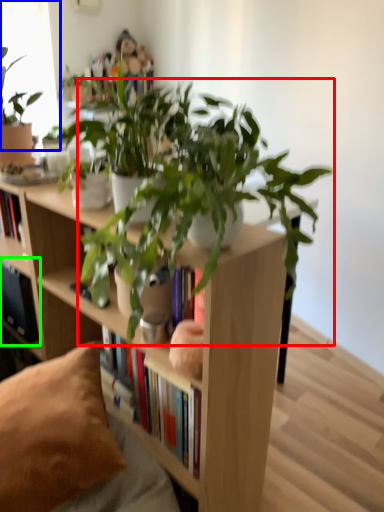
Question: Which object is the farthest from houseplant (highlighted by a red box)? Choose among these: window screen (highlighted by a blue box) or shelf (highlighted by a green box).

Choices:
 (A) window screen
 (B) shelf

Answer: (A)